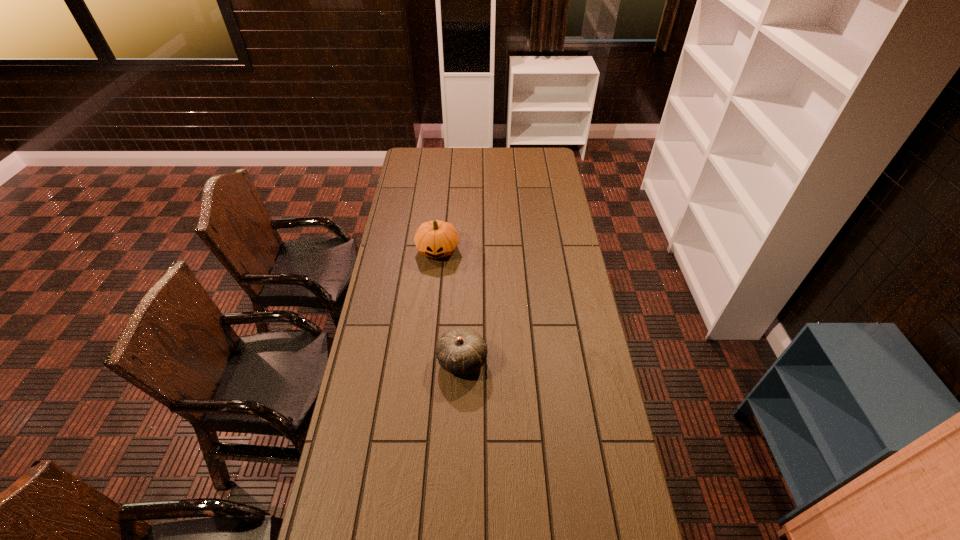
Where is `the farther gourd`? the farther gourd is located at coordinates (435, 239).

Identify the location of the taller object. This screenshot has height=540, width=960. (435, 239).

Image resolution: width=960 pixels, height=540 pixels. Identify the location of the shorter object. (461, 350).

Image resolution: width=960 pixels, height=540 pixels. I want to click on the nearer object, so click(x=461, y=350).

Where is `free point located 0.080m on the side of the taller object with the carved face`? Image resolution: width=960 pixels, height=540 pixels. free point located 0.080m on the side of the taller object with the carved face is located at coordinates pos(435,278).

Find the location of a particular element. vacant space located on the right of the nearer object is located at coordinates (532, 360).

Identify the location of object located at the left edge. (435, 239).

This screenshot has width=960, height=540. In order to click on vacant space at the far edge of the desktop in this screenshot , I will do `click(525, 148)`.

At what (x,y) coordinates should I click in order to perform the action: click on vacant region at the left edge. Please return your answer as a coordinate pair (x, y). The image size is (960, 540). Looking at the image, I should click on (405, 255).

Identify the location of vacant space at the right edge. This screenshot has height=540, width=960. (585, 468).